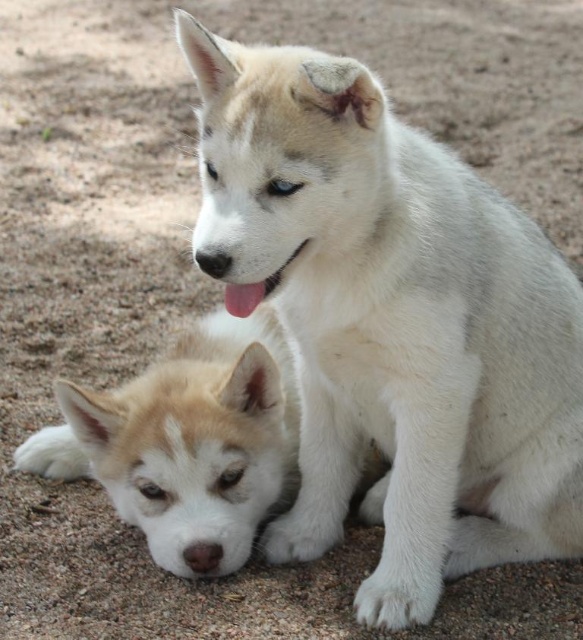
You are a photographer trying to capture both the white fur dog at center and the fuzzy white puppy at lower left in the same frame. Based on their positions, which one would appear larger in the photo?

The white fur dog at center would appear larger in the photo because it is closer to the viewer than the fuzzy white puppy at lower left.

You are standing at the point with coordinates (391, 321). You want to walk to the white fur dog at center. Is the white fur dog at center in front of you or behind you?

The point (391, 321) indicates the location of the white fur dog at center, so you are already at the position of the white fur dog at center.